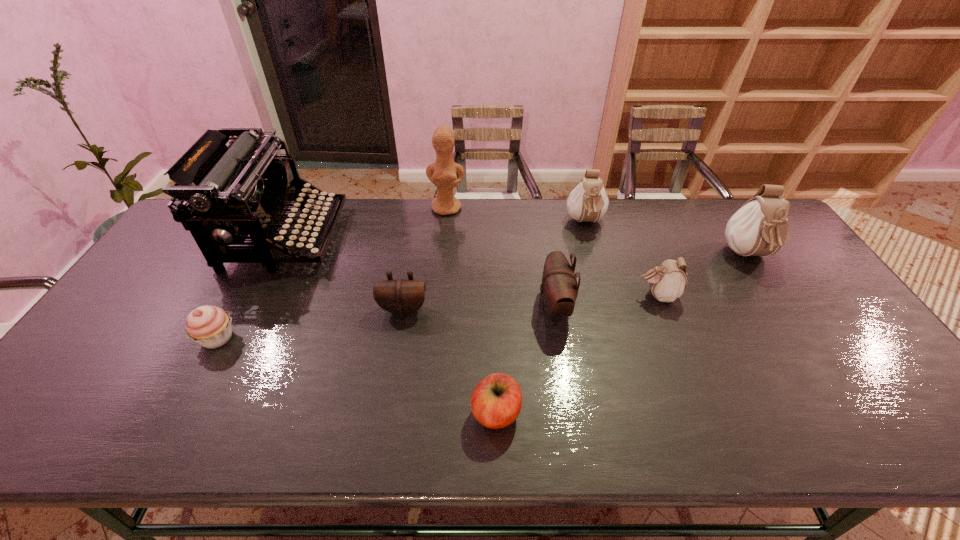
You are a GUI agent. You are given a task and a screenshot of the screen. Output one action in this format:
    pyautogui.click(x=<x>, y=<y>)
    Task: Click on the vacant region located 0.350m with the flap open on the fourth object from right to left
    
    Given the screenshot: What is the action you would take?
    pyautogui.click(x=412, y=307)

The image size is (960, 540). In order to click on free space located 0.240m with the flap open on the fourth object from right to left in this screenshot , I will do `click(451, 307)`.

Locate an element on the screen. vacant space situated 0.340m on the front-facing side of the eighth object from left to right is located at coordinates (516, 295).

The width and height of the screenshot is (960, 540). In order to click on vacant region located 0.290m on the front-facing side of the eighth object from left to right in this screenshot , I will do `click(535, 295)`.

At what (x,y) coordinates should I click in order to perform the action: click on free region located on the front-facing side of the eighth object from left to right. Please return your answer as a coordinate pair (x, y). Image resolution: width=960 pixels, height=540 pixels. Looking at the image, I should click on (538, 295).

Where is `vacant space situated with the flap open on the left brown pouch`? vacant space situated with the flap open on the left brown pouch is located at coordinates (398, 336).

Locate an element on the screen. The image size is (960, 540). free space located on the back of the pink cupcake is located at coordinates point(265,250).

Locate an element on the screen. vacant region located 0.130m on the back of the nearest object is located at coordinates (494, 346).

This screenshot has width=960, height=540. I want to click on typewriter at the far edge, so click(x=238, y=192).

Locate an element on the screen. The width and height of the screenshot is (960, 540). figurine located at the far edge is located at coordinates point(442,173).